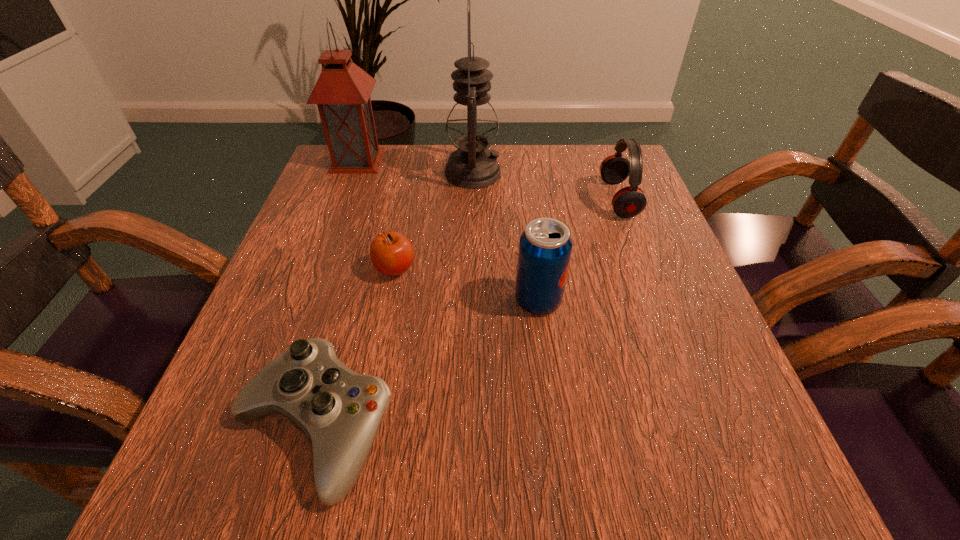
Find the location of a particular element. The width and height of the screenshot is (960, 540). vacant space located on the ear cups of the rightmost object is located at coordinates (432, 199).

The image size is (960, 540). What are the coordinates of `vacant point located 0.210m on the ear cups of the rightmost object` in the screenshot? It's located at (509, 199).

This screenshot has height=540, width=960. What are the coordinates of `vacant space located on the ear cups of the rightmost object` in the screenshot? It's located at (450, 199).

Identify the location of vacant space located on the right of the apple. The height and width of the screenshot is (540, 960). (545, 269).

You are a GUI agent. You are given a task and a screenshot of the screen. Output one action in this format:
    pyautogui.click(x=<x>, y=<y>)
    Task: Click on the vacant space located 0.080m on the right of the control
    The height and width of the screenshot is (540, 960).
    Given the screenshot: What is the action you would take?
    pyautogui.click(x=454, y=428)

This screenshot has width=960, height=540. In order to click on oil lamp located in the far edge section of the desktop in this screenshot , I will do `click(472, 125)`.

This screenshot has width=960, height=540. Find the location of `lantern present at the far edge`. lantern present at the far edge is located at coordinates (342, 92).

This screenshot has width=960, height=540. Find the location of `earphone at the far edge`. earphone at the far edge is located at coordinates (628, 202).

The height and width of the screenshot is (540, 960). What are the coordinates of `object located in the near edge section of the desktop` in the screenshot? It's located at (339, 411).

Locate an element on the screen. lantern that is positioned at the left edge is located at coordinates (342, 92).